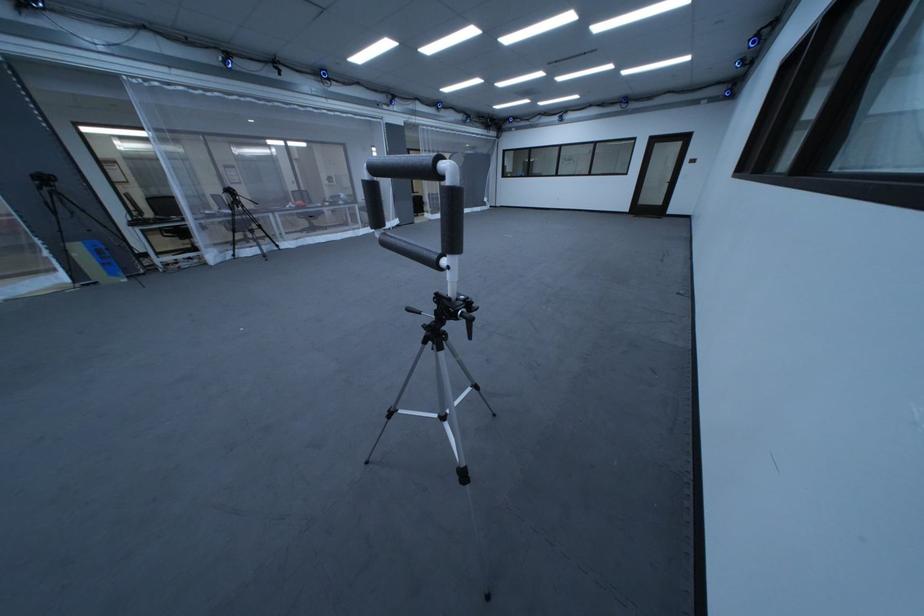
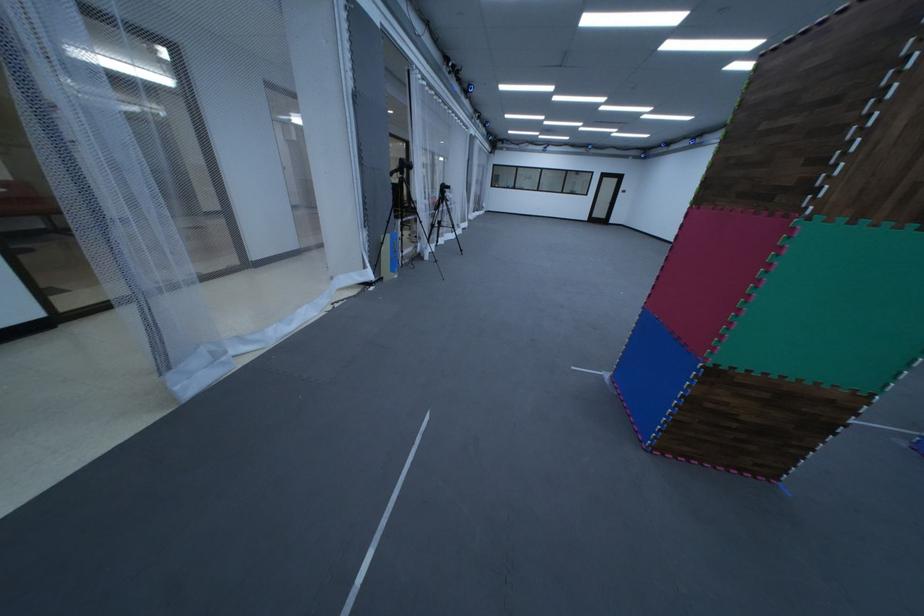
Find the pixel in the second image that matches point (91, 256) in the first image.

(398, 249)